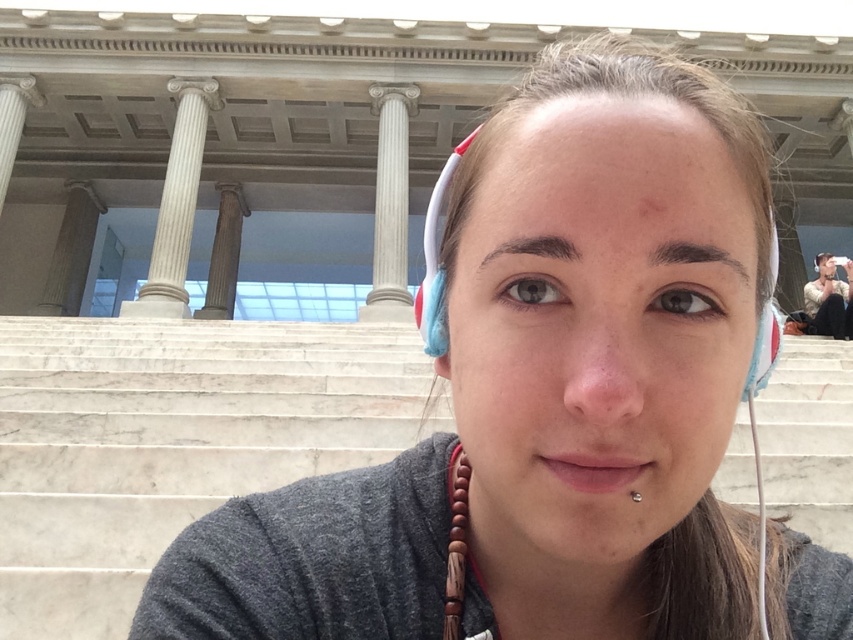
You are a drone operator trying to deliver a small package to a person standing near the silver metallic earring at lower center. The light brown leather jacket at upper right is blocking your path. Can you fly the drone safely between them without hitting anything?

The distance between the light brown leather jacket at upper right and the silver metallic earring at lower center is 23.31 meters, which is a sufficient gap for the drone to navigate safely between them without any obstruction.

You are a photographer standing at the base of the grand structure in the background. You want to take a photo of the white marble pillar at upper left and the silver metallic earring at lower center in the same frame. Given that your camera has a 50mm lens, which has a field of view of approximately 46 degrees, can you capture both objects in the same photo without moving your position?

The white marble pillar at upper left is 32.24 meters away from the silver metallic earring at lower center. To determine if they can be captured in the same frame with a 50mm lens, we need to calculate the angular distance between them. However, without knowing the exact horizontal or vertical distance between the objects relative to the camera, it is impossible to definitively answer. The provided information only states the linear distance between the two objects, not their positions in the frame. Thus,

You are standing in front of the grand architectural structure shown in the image. You notice two points marked on the structure. The first point is at coordinates point (393, 278) and the second is at point (233, 192). Which of these two points is closer to you?

Point (393, 278) is closer to the viewer than point (233, 192) according to the description.